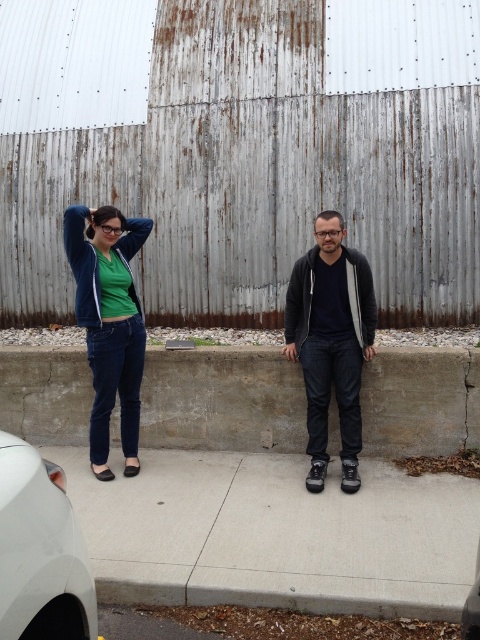
You are a delivery robot with a package that needs to be placed between the concrete at center and the dark gray hoodie at center. The package is 60 centimeters long. Will the package fit in the space between them?

The concrete at center is 62.40 centimeters from dark gray hoodie at center, so the package will fit as the space is slightly larger than the package length.

You are a photographer trying to capture the white matte car at lower left without the dark gray hoodie at center blocking it. Can you move the car or the hoodie to achieve this?

The dark gray hoodie at center is positioned over the white matte car at lower left, so moving either the car or the hoodie would allow you to capture the car without obstruction.

You are a photographer trying to capture both the dark gray hoodie at center and the concrete at center in a single shot. However, the camera lens has a limited depth of field. Which object should you focus on to ensure the other remains in focus?

You should focus on the dark gray hoodie at center because it is behind the concrete at center, so focusing on the farther object will keep both in focus.